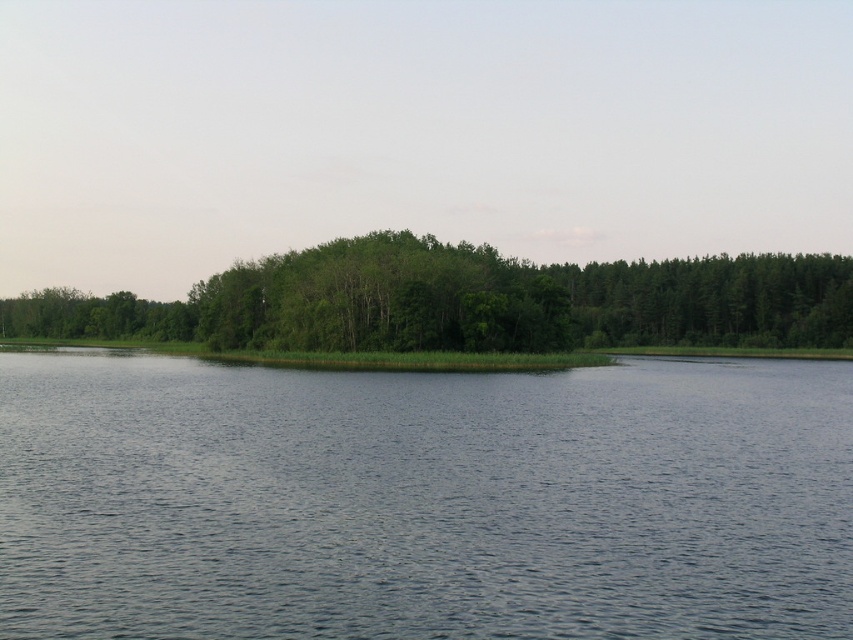
Question: Considering the relative positions of blue water at center and green leafy trees at center in the image provided, where is blue water at center located with respect to green leafy trees at center?

Choices:
 (A) left
 (B) right

Answer: (B)

Question: From the image, what is the correct spatial relationship of blue water at center in relation to green leafy trees at center?

Choices:
 (A) left
 (B) right

Answer: (B)

Question: In this image, where is blue water at center located relative to green leafy trees at center?

Choices:
 (A) right
 (B) left

Answer: (A)